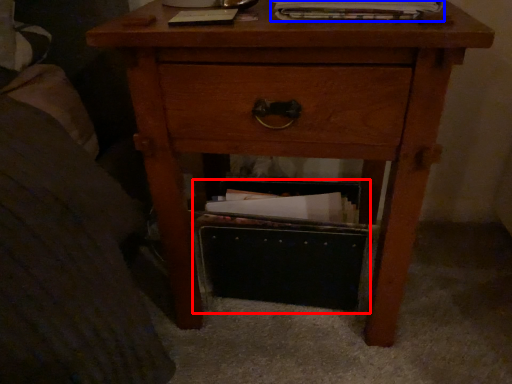
Question: Among these objects, which one is farthest to the camera, shoe box (highlighted by a red box) or magazine (highlighted by a blue box)?

Choices:
 (A) shoe box
 (B) magazine

Answer: (A)